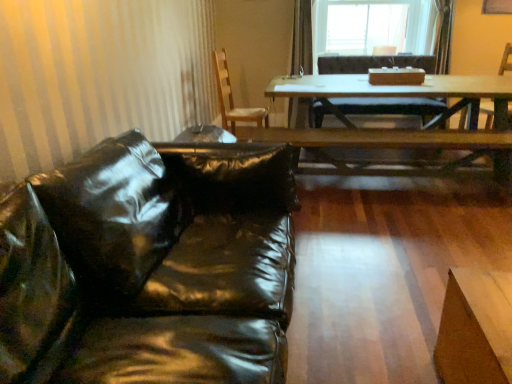
Question: Can you confirm if transparent plastic window screen at upper center is positioned to the right of brown leather chair at upper right, which ranks as the 1th chair in right-to-left order?

Choices:
 (A) no
 (B) yes

Answer: (B)

Question: Does transparent plastic window screen at upper center have a lesser width compared to brown leather chair at upper right, which ranks as the 1th chair in right-to-left order?

Choices:
 (A) yes
 (B) no

Answer: (A)

Question: Is transparent plastic window screen at upper center surrounding brown leather chair at upper right, the 2th chair when ordered from left to right?

Choices:
 (A) no
 (B) yes

Answer: (A)

Question: Is transparent plastic window screen at upper center aimed at brown leather chair at upper right, which ranks as the 1th chair in right-to-left order?

Choices:
 (A) no
 (B) yes

Answer: (A)

Question: From a real-world perspective, is transparent plastic window screen at upper center located beneath brown leather chair at upper right, the 2th chair when ordered from left to right?

Choices:
 (A) no
 (B) yes

Answer: (A)

Question: Considering the relative sizes of transparent plastic window screen at upper center and brown leather chair at upper right, the 2th chair when ordered from left to right, in the image provided, is transparent plastic window screen at upper center wider than brown leather chair at upper right, the 2th chair when ordered from left to right,?

Choices:
 (A) yes
 (B) no

Answer: (B)

Question: Considering the relative sizes of glossy black leather couch at left and wooden armchair at right in the image provided, is glossy black leather couch at left wider than wooden armchair at right?

Choices:
 (A) yes
 (B) no

Answer: (A)

Question: Considering the relative sizes of glossy black leather couch at left and wooden armchair at right in the image provided, is glossy black leather couch at left bigger than wooden armchair at right?

Choices:
 (A) yes
 (B) no

Answer: (A)

Question: Does glossy black leather couch at left have a greater height compared to wooden armchair at right?

Choices:
 (A) yes
 (B) no

Answer: (B)

Question: Is glossy black leather couch at left to the right of wooden armchair at right from the viewer's perspective?

Choices:
 (A) yes
 (B) no

Answer: (B)

Question: Is glossy black leather couch at left at the left side of wooden armchair at right?

Choices:
 (A) no
 (B) yes

Answer: (B)

Question: Is glossy black leather couch at left far away from wooden armchair at right?

Choices:
 (A) yes
 (B) no

Answer: (A)

Question: Is wooden armchair at right bigger than wooden chair at center, acting as the 2th chair starting from the right?

Choices:
 (A) no
 (B) yes

Answer: (B)